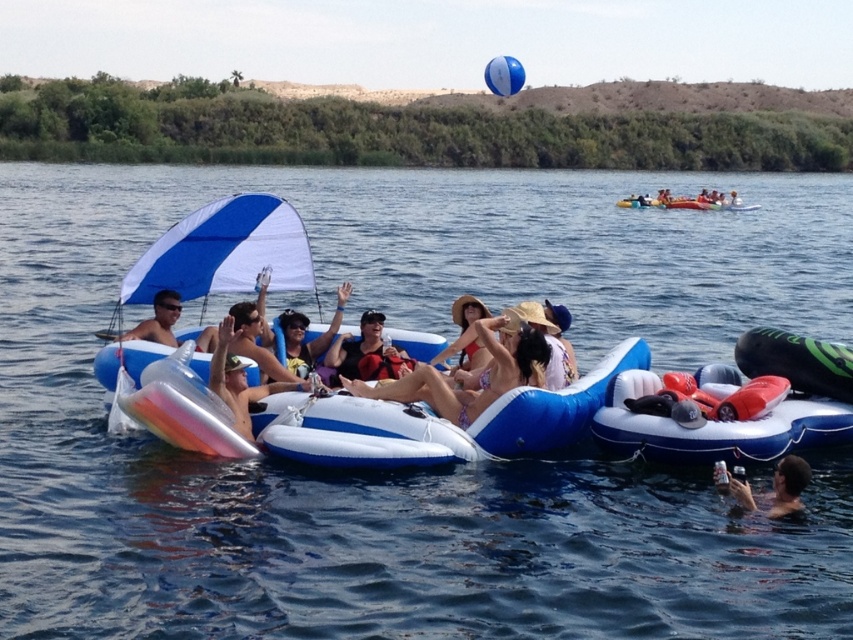
Between pink bikini at center and smooth skin person at lower right, which one is positioned higher?

pink bikini at center

Is pink bikini at center thinner than smooth skin person at lower right?

In fact, pink bikini at center might be wider than smooth skin person at lower right.

Which is in front, point (437, 378) or point (802, 465)?

Positioned in front is point (802, 465).

Identify the location of pink bikini at center. (480, 372).

Between point (389, 348) and point (517, 83), which one is positioned behind?

Positioned behind is point (517, 83).

Between matte black life vest at center and blue rubber balloon at upper center, which one is positioned lower?

matte black life vest at center

I want to click on matte black life vest at center, so click(366, 353).

You are a GUI agent. You are given a task and a screenshot of the screen. Output one action in this format:
    pyautogui.click(x=<x>, y=<y>)
    Task: Click on the matte black life vest at center
    This screenshot has width=853, height=640.
    Given the screenshot: What is the action you would take?
    pyautogui.click(x=366, y=353)

Based on the photo, how far apart are rubberized blue and white raft at lower right and matte black sunglasses at center?

rubberized blue and white raft at lower right and matte black sunglasses at center are 11.29 meters apart from each other.

This screenshot has width=853, height=640. I want to click on rubberized blue and white raft at lower right, so click(717, 428).